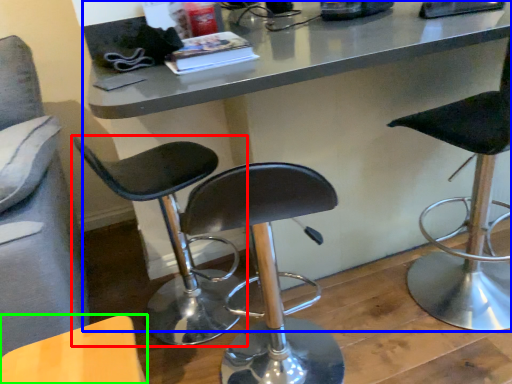
Question: Which is farther away from chair (highlighted by a red box)? table (highlighted by a blue box) or chair (highlighted by a green box)?

Choices:
 (A) table
 (B) chair

Answer: (B)